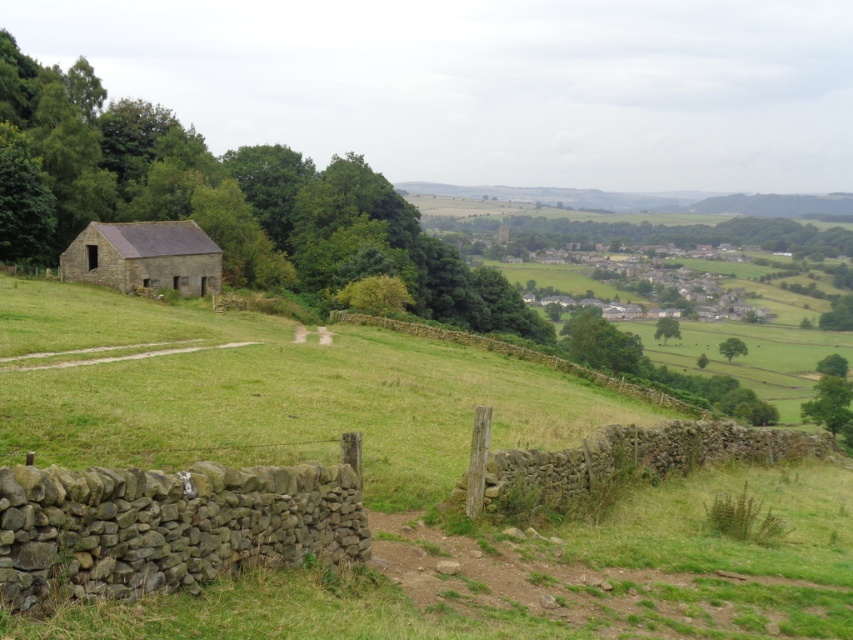
You are standing at the wooden post at the corner of the rustic stone wall in the foreground of the rural landscape. You see two points marked in the image. Which point, point (248, 540) or point (134, 228), is closer to you?

Point (248, 540) is closer to you than point (134, 228).

You are a farmer checking the boundaries of your land. You have a fence that is 10 meters long. You need to decide whether to place it around the rustic stone barn at lower left or along the dry stone wall at center. Based on their sizes, which area would require less fencing material?

The rustic stone barn at lower left has a smaller size compared to dry stone wall at center, so placing the fence around the rustic stone barn at lower left would require less fencing material.

You are a farmer checking the boundaries of your land. You have a 1.2 meter wide tractor that needs to pass between the brown stone wall at lower left and the dry stone wall at center. Can your tractor fit through the space between them?

The brown stone wall at lower left has a lesser width compared to dry stone wall at center, so the space between them is wider than the tractor. The tractor can pass through the space between the brown stone wall at lower left and the dry stone wall at center.